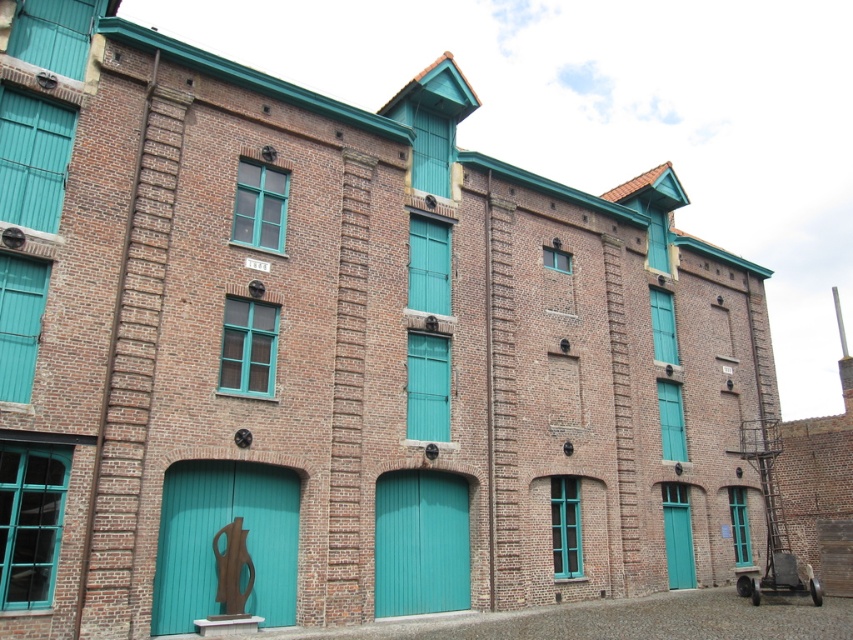
Question: Does teal wooden door at lower left have a larger size compared to teal matte/glossy door at center?

Choices:
 (A) no
 (B) yes

Answer: (B)

Question: Which of the following is the farthest from the observer?

Choices:
 (A) teal matte door at center
 (B) teal matte/glossy door at center
 (C) teal wooden door at lower left

Answer: (A)

Question: Which object appears closest to the camera in this image?

Choices:
 (A) teal matte door at center
 (B) teal wooden door at lower left
 (C) teal matte/glossy door at center

Answer: (B)

Question: From the image, what is the correct spatial relationship of teal matte/glossy door at center in relation to teal matte door at center?

Choices:
 (A) below
 (B) above

Answer: (B)

Question: Which point is farther to the camera?

Choices:
 (A) (677, 529)
 (B) (379, 561)

Answer: (A)

Question: Is teal matte/glossy door at center below teal matte door at center?

Choices:
 (A) yes
 (B) no

Answer: (B)